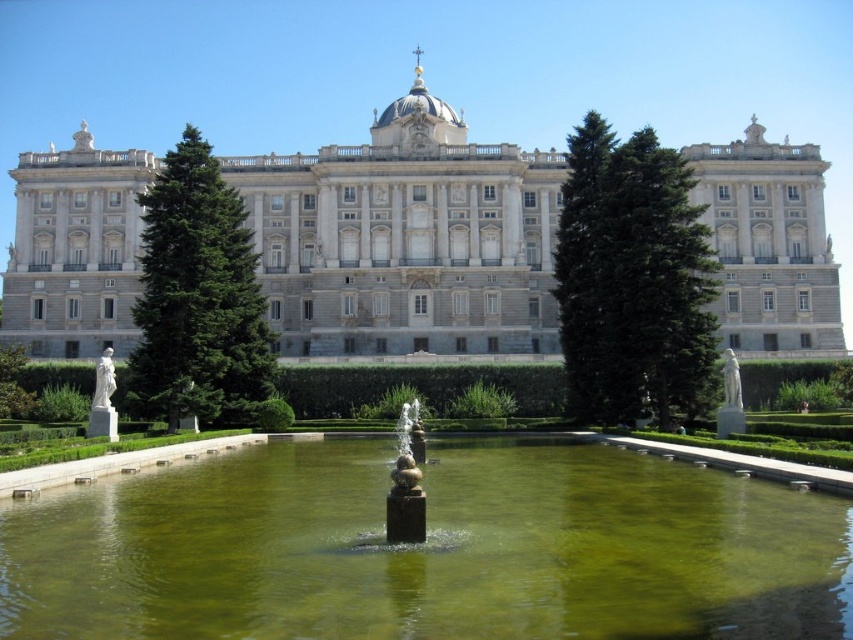
Who is shorter, green textured tree at center or white marble statue at left?

Standing shorter between the two is white marble statue at left.

Does green textured tree at center have a greater height compared to white marble statue at left?

Correct, green textured tree at center is much taller as white marble statue at left.

This screenshot has height=640, width=853. What are the coordinates of `green textured tree at center` in the screenshot? It's located at (631, 280).

Can you confirm if green glossy tree at center is smaller than white marble statue at left?

Incorrect, green glossy tree at center is not smaller in size than white marble statue at left.

Who is taller, green glossy tree at center or white marble statue at left?

With more height is green glossy tree at center.

Which is in front, point (178, 381) or point (102, 355)?

Point (178, 381)

The height and width of the screenshot is (640, 853). I want to click on green glossy tree at center, so click(198, 298).

Can you confirm if green water at center is positioned to the left of white stone palace at center?

No, green water at center is not to the left of white stone palace at center.

Between green water at center and white stone palace at center, which one is positioned lower?

green water at center is lower down.

Find the location of `green water at center`. green water at center is located at coordinates (428, 548).